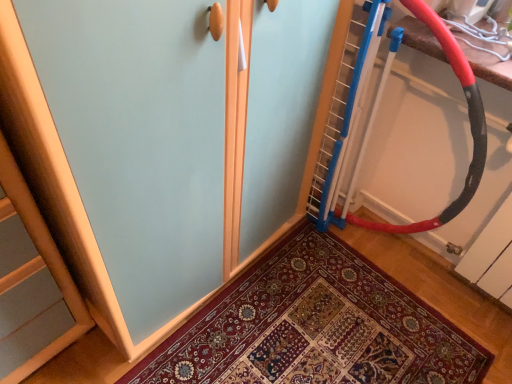
Describe the element at coordinates (315, 327) in the screenshot. The height and width of the screenshot is (384, 512). I see `patterned carpet at center` at that location.

Measure the distance between patterned carpet at center and camera.

patterned carpet at center is 4.12 feet away from camera.

This screenshot has width=512, height=384. I want to click on patterned carpet at center, so click(x=315, y=327).

What is the approximate height of red rubber garden hose at right?

37.85 inches.

This screenshot has height=384, width=512. I want to click on red rubber garden hose at right, so pyautogui.click(x=469, y=119).

What do you see at coordinates (469, 119) in the screenshot?
I see `red rubber garden hose at right` at bounding box center [469, 119].

Measure the distance between point (x=431, y=30) and camera.

The distance of point (x=431, y=30) from camera is 3.36 feet.

Identify the location of patterned carpet at center. (315, 327).

Considering the positions of objects red rubber garden hose at right and patterned carpet at center in the image provided, who is more to the left, red rubber garden hose at right or patterned carpet at center?

patterned carpet at center is more to the left.

In the scene shown: Considering the positions of objects red rubber garden hose at right and patterned carpet at center in the image provided, who is in front, red rubber garden hose at right or patterned carpet at center?

Positioned in front is red rubber garden hose at right.

Does point (373, 12) appear closer or farther from the camera than point (334, 378)?

Point (373, 12).

From the image's perspective, is red rubber garden hose at right above or below patterned carpet at center?

Based on their image positions, red rubber garden hose at right is located above patterned carpet at center.

From a real-world perspective, which object stands above the other?

From a 3D spatial view, red rubber garden hose at right is above.

Is red rubber garden hose at right wider or thinner than patterned carpet at center?

red rubber garden hose at right is thinner than patterned carpet at center.

Who is taller, red rubber garden hose at right or patterned carpet at center?

With more height is red rubber garden hose at right.

Can you confirm if red rubber garden hose at right is bigger than patterned carpet at center?

Correct, red rubber garden hose at right is larger in size than patterned carpet at center.

Could patterned carpet at center be considered to be inside red rubber garden hose at right?

No, patterned carpet at center is not inside red rubber garden hose at right.

Would you say red rubber garden hose at right is a long distance from patterned carpet at center?

That's not correct — red rubber garden hose at right is a little close to patterned carpet at center.

Is red rubber garden hose at right looking in the opposite direction of patterned carpet at center?

No.

Measure the distance from red rubber garden hose at right to patterned carpet at center.

red rubber garden hose at right is 17.92 inches away from patterned carpet at center.

The width and height of the screenshot is (512, 384). In order to click on mat on the left of red rubber garden hose at right in this screenshot , I will do `click(315, 327)`.

Would you say patterned carpet at center is to the left or to the right of red rubber garden hose at right in the picture?

patterned carpet at center is positioned on red rubber garden hose at right's left side.

Considering the positions of objects patterned carpet at center and red rubber garden hose at right in the image provided, who is behind, patterned carpet at center or red rubber garden hose at right?

Positioned behind is patterned carpet at center.

Is point (254, 289) farther from camera compared to point (452, 52)?

That is True.

From the image's perspective, is patterned carpet at center above or below red rubber garden hose at right?

Based on their image positions, patterned carpet at center is located beneath red rubber garden hose at right.

From a real-world perspective, is patterned carpet at center above or below red rubber garden hose at right?

Clearly, from a real-world perspective, patterned carpet at center is below red rubber garden hose at right.

Considering the sizes of objects patterned carpet at center and red rubber garden hose at right in the image provided, who is thinner, patterned carpet at center or red rubber garden hose at right?

With smaller width is red rubber garden hose at right.

From their relative heights in the image, would you say patterned carpet at center is taller or shorter than red rubber garden hose at right?

Considering their sizes, patterned carpet at center has less height than red rubber garden hose at right.

Can you confirm if patterned carpet at center is smaller than red rubber garden hose at right?

Correct, patterned carpet at center occupies less space than red rubber garden hose at right.

Would you say patterned carpet at center contains red rubber garden hose at right?

No, red rubber garden hose at right is not inside patterned carpet at center.

Would you consider patterned carpet at center to be distant from red rubber garden hose at right?

No, patterned carpet at center is in close proximity to red rubber garden hose at right.

Does patterned carpet at center turn towards red rubber garden hose at right?

No, patterned carpet at center is not facing towards red rubber garden hose at right.

Find the location of a particular element. The image size is (512, 384). garden hose that appears on the right of patterned carpet at center is located at coordinates (469, 119).

You are a GUI agent. You are given a task and a screenshot of the screen. Output one action in this format:
    pyautogui.click(x=<x>, y=<y>)
    Task: Click on the garden hose above the patterned carpet at center (from a real-world perspective)
    
    Given the screenshot: What is the action you would take?
    pyautogui.click(x=469, y=119)

Where is `mat below the red rubber garden hose at right (from the image's perspective)`? mat below the red rubber garden hose at right (from the image's perspective) is located at coordinates (315, 327).